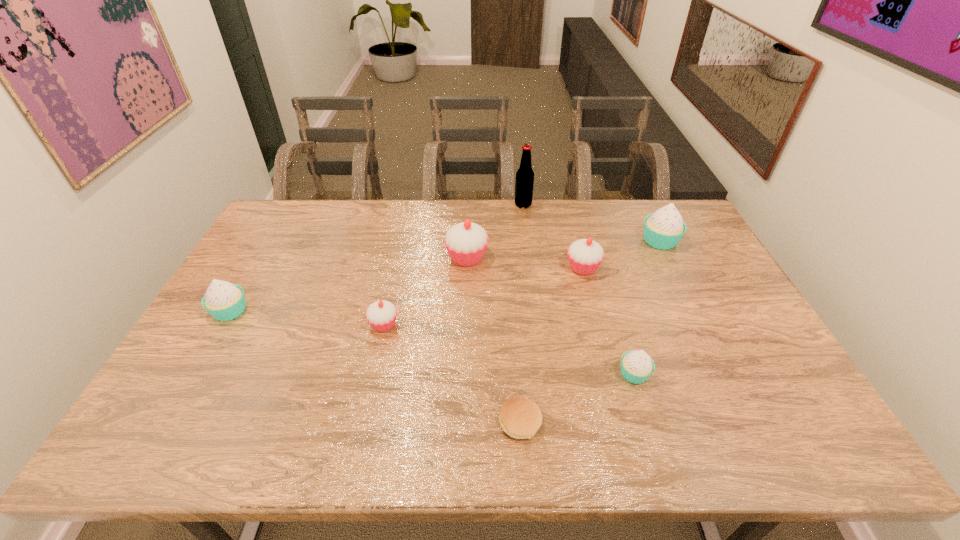
Identify the location of the second object from left to right. The height and width of the screenshot is (540, 960). (381, 315).

Find the location of a particular element. The width and height of the screenshot is (960, 540). the second white cupcake from left to right is located at coordinates (637, 366).

What are the coordinates of `the second nearest object` in the screenshot? It's located at (637, 366).

What are the coordinates of `the nearest object` in the screenshot? It's located at (520, 418).

Image resolution: width=960 pixels, height=540 pixels. What are the coordinates of `patty` in the screenshot? It's located at (520, 418).

Locate an element on the screen. This screenshot has width=960, height=540. free space located 0.220m on the left of the tallest object is located at coordinates (457, 205).

At what (x,y) coordinates should I click in order to perform the action: click on free space located 0.050m on the back of the second pink cupcake from right to left. Please return your answer as a coordinate pair (x, y). Image resolution: width=960 pixels, height=540 pixels. Looking at the image, I should click on (468, 235).

Image resolution: width=960 pixels, height=540 pixels. I want to click on vacant space located on the left of the rightmost white cupcake, so click(556, 241).

At what (x,y) coordinates should I click in order to perform the action: click on vacant space located on the right of the second biggest white cupcake. Please return your answer as a coordinate pair (x, y). Image resolution: width=960 pixels, height=540 pixels. Looking at the image, I should click on (384, 311).

This screenshot has width=960, height=540. What are the coordinates of `free space located 0.050m on the right of the second biggest pink cupcake` in the screenshot? It's located at (617, 268).